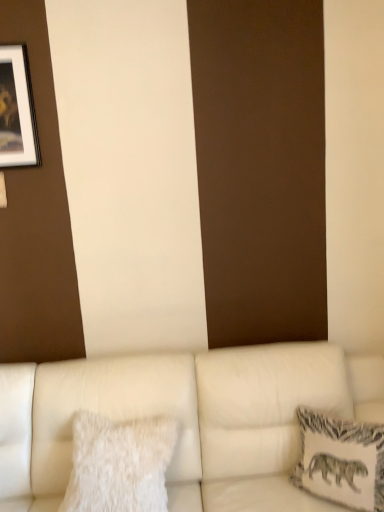
You are a GUI agent. You are given a task and a screenshot of the screen. Output one action in this format:
    pyautogui.click(x=<x>, y=<y>)
    Task: Click on the matte black picture frame at upper left
    
    Given the screenshot: What is the action you would take?
    click(17, 110)

Describe the element at coordinates (341, 460) in the screenshot. I see `white textured pillow at right, arranged as the second pillow when viewed from the left` at that location.

What is the approximate width of white leather couch at lower center?

It is 3.71 feet.

Locate an element on the screen. matte black picture frame at upper left is located at coordinates (17, 110).

Is matte black picture frame at upper left thinner than white textured pillow at right, arranged as the second pillow when viewed from the left?

Indeed, matte black picture frame at upper left has a lesser width compared to white textured pillow at right, arranged as the second pillow when viewed from the left.

In the scene shown: Is matte black picture frame at upper left touching white textured pillow at right, acting as the first pillow starting from the right?

matte black picture frame at upper left and white textured pillow at right, acting as the first pillow starting from the right, are not in contact.

Between matte black picture frame at upper left and white fluffy pillow at lower left, acting as the second pillow starting from the right, which one has more height?

With more height is matte black picture frame at upper left.

Is matte black picture frame at upper left thinner than white fluffy pillow at lower left, the 1th pillow positioned from the left?

Correct, the width of matte black picture frame at upper left is less than that of white fluffy pillow at lower left, the 1th pillow positioned from the left.

In the image, is matte black picture frame at upper left positioned in front of or behind white fluffy pillow at lower left, acting as the second pillow starting from the right?

matte black picture frame at upper left is behind white fluffy pillow at lower left, acting as the second pillow starting from the right.

Is white textured pillow at right, acting as the first pillow starting from the right, closer to the viewer compared to matte black picture frame at upper left?

Yes, the depth of white textured pillow at right, acting as the first pillow starting from the right, is less than that of matte black picture frame at upper left.

How much distance is there between white textured pillow at right, acting as the first pillow starting from the right, and matte black picture frame at upper left?

white textured pillow at right, acting as the first pillow starting from the right, and matte black picture frame at upper left are 1.79 meters apart.

Considering the points (322, 463) and (31, 148), which point is behind, point (322, 463) or point (31, 148)?

Positioned behind is point (31, 148).

Would you consider white textured pillow at right, arranged as the second pillow when viewed from the left, to be distant from matte black picture frame at upper left?

white textured pillow at right, arranged as the second pillow when viewed from the left, is positioned a significant distance from matte black picture frame at upper left.

From a real-world perspective, which object stands above the other?

From a 3D spatial view, white textured pillow at right, arranged as the second pillow when viewed from the left, is above.

In the image, is white textured pillow at right, arranged as the second pillow when viewed from the left, on the left side or the right side of white leather couch at lower center?

white textured pillow at right, arranged as the second pillow when viewed from the left, is to the right of white leather couch at lower center.

Is white leather couch at lower center surrounded by white textured pillow at right, acting as the first pillow starting from the right?

No, white leather couch at lower center is located outside of white textured pillow at right, acting as the first pillow starting from the right.

Which is more to the right, white leather couch at lower center or matte black picture frame at upper left?

white leather couch at lower center.

You are a GUI agent. You are given a task and a screenshot of the screen. Output one action in this format:
    pyautogui.click(x=<x>, y=<y>)
    Task: Click on the studio couch below the matte black picture frame at upper left (from a real-world perspective)
    Image resolution: width=384 pixels, height=512 pixels.
    Given the screenshot: What is the action you would take?
    pyautogui.click(x=186, y=419)

Which object is closer to the camera taking this photo, white fluffy pillow at lower left, acting as the second pillow starting from the right, or white textured pillow at right, arranged as the second pillow when viewed from the left?

white textured pillow at right, arranged as the second pillow when viewed from the left, is in front.

Measure the distance from white fluffy pillow at lower left, acting as the second pillow starting from the right, to white textured pillow at right, acting as the first pillow starting from the right.

white fluffy pillow at lower left, acting as the second pillow starting from the right, is 27.19 inches away from white textured pillow at right, acting as the first pillow starting from the right.

Considering the positions of points (90, 442) and (330, 432), is point (90, 442) farther from camera compared to point (330, 432)?

No, (90, 442) is closer to viewer.

From a real-world perspective, is white fluffy pillow at lower left, the 1th pillow positioned from the left, physically above white textured pillow at right, acting as the first pillow starting from the right?

Yes, from a real-world perspective, white fluffy pillow at lower left, the 1th pillow positioned from the left, is on top of white textured pillow at right, acting as the first pillow starting from the right.

Considering the sizes of objects white fluffy pillow at lower left, acting as the second pillow starting from the right, and matte black picture frame at upper left in the image provided, who is wider, white fluffy pillow at lower left, acting as the second pillow starting from the right, or matte black picture frame at upper left?

Wider between the two is white fluffy pillow at lower left, acting as the second pillow starting from the right.

Which of these two, white fluffy pillow at lower left, the 1th pillow positioned from the left, or matte black picture frame at upper left, is smaller?

With smaller size is matte black picture frame at upper left.

Is point (73, 428) closer or farther from the camera than point (14, 166)?

Point (73, 428) appears to be closer to the viewer than point (14, 166).

Locate an element on the screen. picture frame above the white fluffy pillow at lower left, acting as the second pillow starting from the right (from a real-world perspective) is located at coordinates (17, 110).

Image resolution: width=384 pixels, height=512 pixels. There is a matte black picture frame at upper left. In order to click on the 2nd pillow below it (from a real-world perspective) in this screenshot , I will do `click(341, 460)`.

There is a white fluffy pillow at lower left, the 1th pillow positioned from the left. Where is `picture frame above it (from a real-world perspective)`? Image resolution: width=384 pixels, height=512 pixels. picture frame above it (from a real-world perspective) is located at coordinates (17, 110).

When comparing their distances from white leather couch at lower center, does white textured pillow at right, acting as the first pillow starting from the right, or white fluffy pillow at lower left, acting as the second pillow starting from the right, seem closer?

white fluffy pillow at lower left, acting as the second pillow starting from the right, is positioned closer to the anchor white leather couch at lower center.

Considering their positions, is white fluffy pillow at lower left, the 1th pillow positioned from the left, positioned further to matte black picture frame at upper left than white leather couch at lower center?

white fluffy pillow at lower left, the 1th pillow positioned from the left, lies further to matte black picture frame at upper left than the other object.

Based on their spatial positions, is matte black picture frame at upper left or white leather couch at lower center further from white fluffy pillow at lower left, acting as the second pillow starting from the right?

Based on the image, matte black picture frame at upper left appears to be further to white fluffy pillow at lower left, acting as the second pillow starting from the right.

Considering their positions, is white textured pillow at right, acting as the first pillow starting from the right, positioned closer to white fluffy pillow at lower left, acting as the second pillow starting from the right, than matte black picture frame at upper left?

white textured pillow at right, acting as the first pillow starting from the right.

Considering their positions, is white textured pillow at right, arranged as the second pillow when viewed from the left, positioned further to white leather couch at lower center than matte black picture frame at upper left?

Based on the image, matte black picture frame at upper left appears to be further to white leather couch at lower center.

Considering their positions, is white leather couch at lower center positioned closer to matte black picture frame at upper left than white textured pillow at right, acting as the first pillow starting from the right?

Among the two, white leather couch at lower center is located nearer to matte black picture frame at upper left.

Which object lies nearer to the anchor point white textured pillow at right, arranged as the second pillow when viewed from the left, white fluffy pillow at lower left, the 1th pillow positioned from the left, or white leather couch at lower center?

white leather couch at lower center is closer to white textured pillow at right, arranged as the second pillow when viewed from the left.

Which object lies nearer to the anchor point white textured pillow at right, arranged as the second pillow when viewed from the left, white fluffy pillow at lower left, acting as the second pillow starting from the right, or matte black picture frame at upper left?

white fluffy pillow at lower left, acting as the second pillow starting from the right, is closer to white textured pillow at right, arranged as the second pillow when viewed from the left.

Find the location of a particular element. The width and height of the screenshot is (384, 512). pillow between matte black picture frame at upper left and white fluffy pillow at lower left, acting as the second pillow starting from the right, in the up-down direction is located at coordinates (341, 460).

The image size is (384, 512). Identify the location of studio couch between white fluffy pillow at lower left, the 1th pillow positioned from the left, and white textured pillow at right, acting as the first pillow starting from the right, in the horizontal direction. (x=186, y=419).